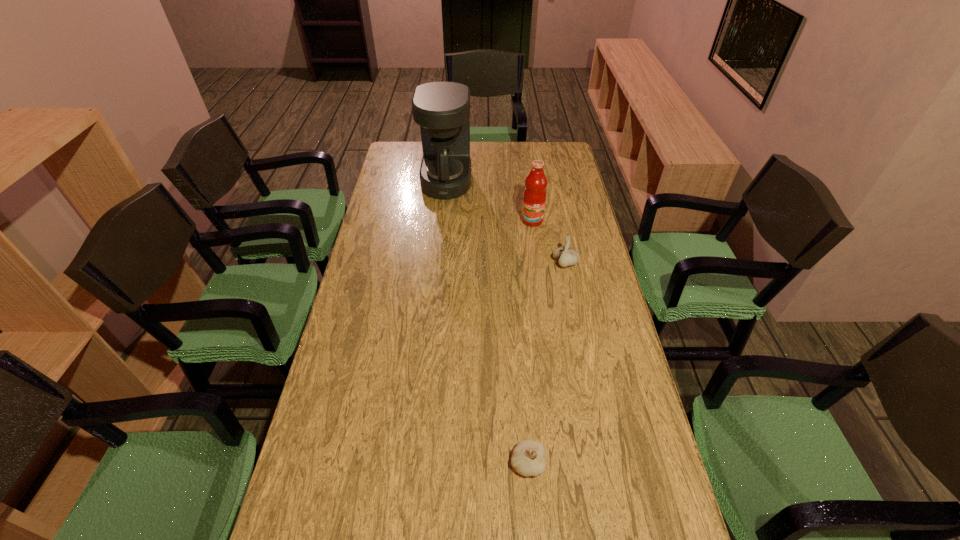
Image resolution: width=960 pixels, height=540 pixels. In order to click on blank area located on the left of the rightmost object in this screenshot , I will do `click(484, 263)`.

This screenshot has width=960, height=540. In order to click on vacant region located 0.240m on the back of the third object from right to left in this screenshot , I will do `click(520, 363)`.

Locate an element on the screen. This screenshot has height=540, width=960. object located at the far edge is located at coordinates (442, 109).

Where is `object that is at the right edge`? This screenshot has height=540, width=960. object that is at the right edge is located at coordinates (567, 256).

Identify the location of vacant space at the far edge. The width and height of the screenshot is (960, 540). (516, 156).

Where is `vacant space at the right edge`? vacant space at the right edge is located at coordinates (603, 483).

You are a GUI agent. You are given a task and a screenshot of the screen. Output one action in this format:
    pyautogui.click(x=<x>, y=<y>)
    Task: Click on the vacant area at the far left corner
    This screenshot has width=960, height=540.
    Given the screenshot: What is the action you would take?
    pyautogui.click(x=400, y=145)

In the image, there is a desktop. Identify the location of vacant region at the far right corner. The height and width of the screenshot is (540, 960). (546, 156).

What are the coordinates of `unoccupied position between the second object from right to left and the farthest object` in the screenshot? It's located at (490, 201).

Where is `free space that is in between the second farthest object and the leftmost object`? This screenshot has height=540, width=960. free space that is in between the second farthest object and the leftmost object is located at coordinates (490, 201).